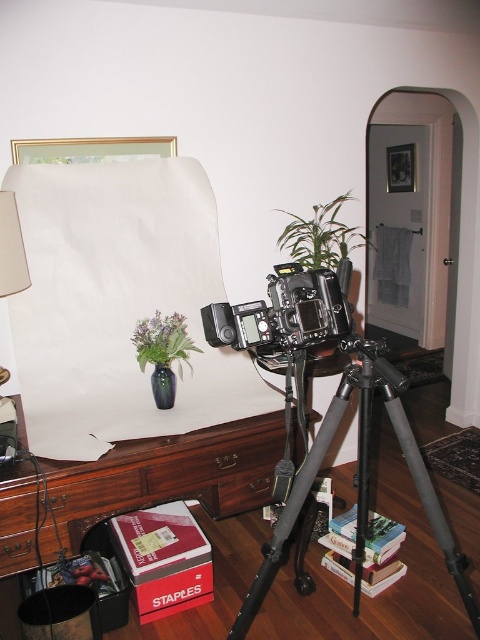
Between green leafy plant at center and beige fabric lampshade at upper left, which one has less height?

beige fabric lampshade at upper left

Which is below, green leafy plant at center or beige fabric lampshade at upper left?

Positioned lower is beige fabric lampshade at upper left.

The width and height of the screenshot is (480, 640). What do you see at coordinates (321, 236) in the screenshot?
I see `green leafy plant at center` at bounding box center [321, 236].

Find the location of a particular element. The width and height of the screenshot is (480, 640). green leafy plant at center is located at coordinates (321, 236).

Can you confirm if green leafy plant at center is positioned above green matte vase at center?

Correct, green leafy plant at center is located above green matte vase at center.

Which is more to the left, green leafy plant at center or green matte vase at center?

green matte vase at center is more to the left.

Is point (317, 243) in front of point (135, 337)?

That is False.

The image size is (480, 640). I want to click on green leafy plant at center, so click(321, 236).

Can you confirm if white paper at center is positioned above brown wood table at center?

Correct, white paper at center is located above brown wood table at center.

Is white paper at center shorter than brown wood table at center?

In fact, white paper at center may be taller than brown wood table at center.

Between point (115, 298) and point (121, 449), which one is positioned in front?

Point (121, 449)

Find the location of a particular element. The image size is (480, 640). white paper at center is located at coordinates (118, 304).